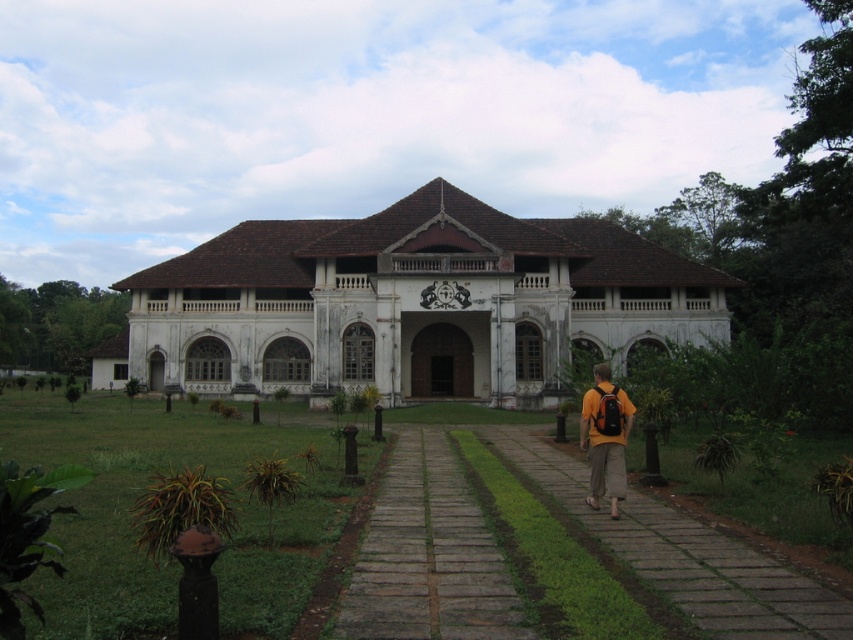
Question: Considering the real-world distances, which object is closest to the gray stone path at center?

Choices:
 (A) white marble mansion at center
 (B) orange fabric backpack at center
 (C) brick paved walkway at center

Answer: (C)

Question: From the image, what is the correct spatial relationship of white marble mansion at center in relation to orange fabric backpack at center?

Choices:
 (A) below
 (B) above

Answer: (B)

Question: Which object is positioned farthest from the orange fabric backpack at center?

Choices:
 (A) white marble mansion at center
 (B) gray stone path at center
 (C) brick paved walkway at center

Answer: (A)

Question: Is white marble mansion at center below gray stone path at center?

Choices:
 (A) no
 (B) yes

Answer: (A)

Question: Which point is closer to the camera?

Choices:
 (A) (732, 616)
 (B) (463, 621)
 (C) (387, 252)

Answer: (B)

Question: Does gray stone path at center appear over orange fabric backpack at center?

Choices:
 (A) no
 (B) yes

Answer: (A)